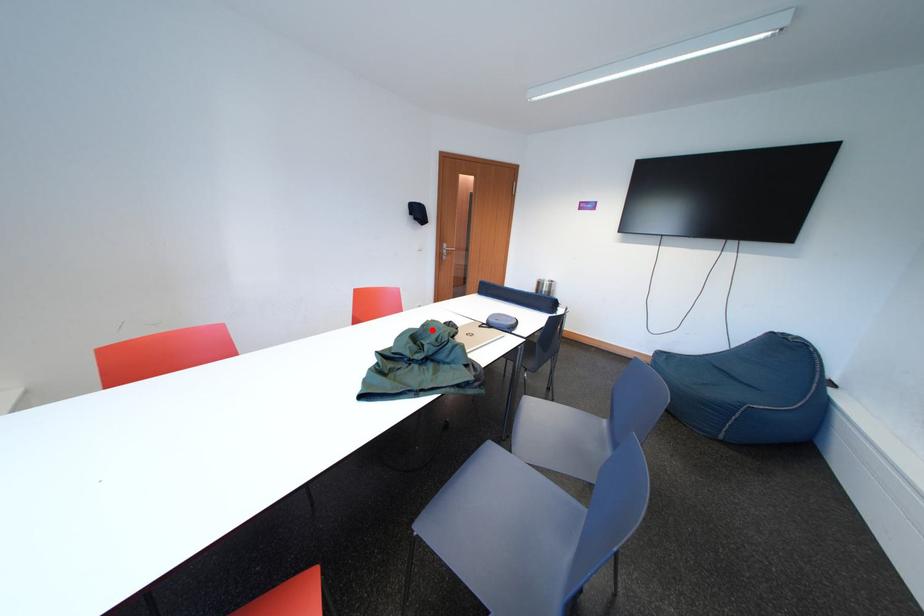
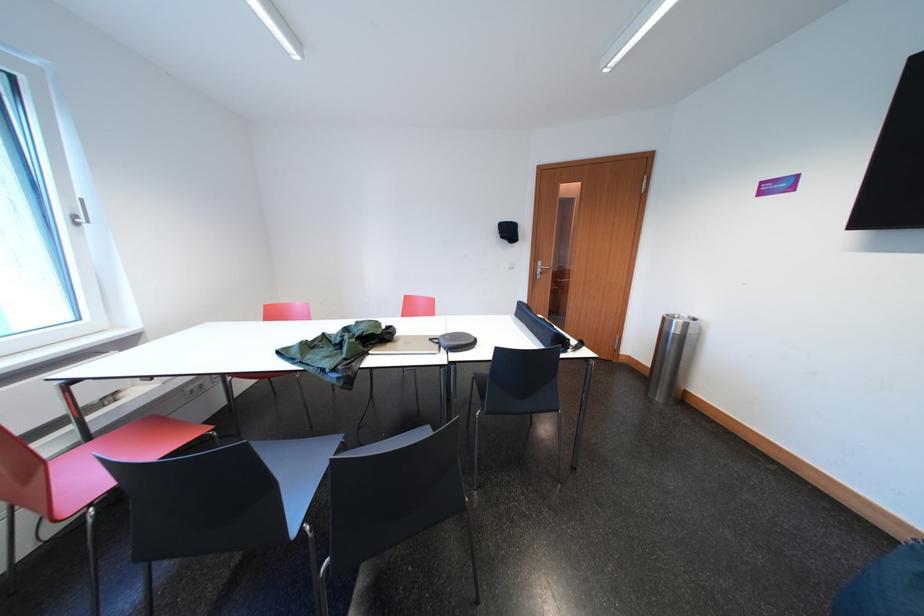
In the second image, find the point that corresponds to the highlighted location in the first image.

(367, 326)